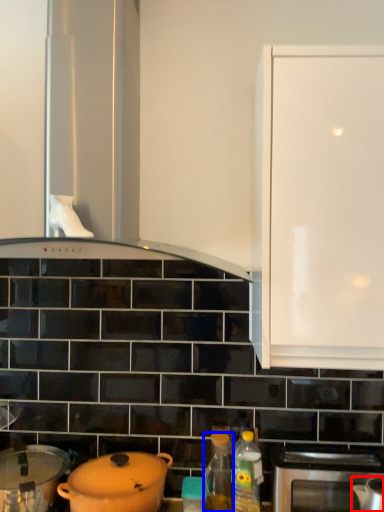
Question: Which object appears farthest to the camera in this image, kitchen appliance (highlighted by a red box) or bottle (highlighted by a blue box)?

Choices:
 (A) kitchen appliance
 (B) bottle

Answer: (B)